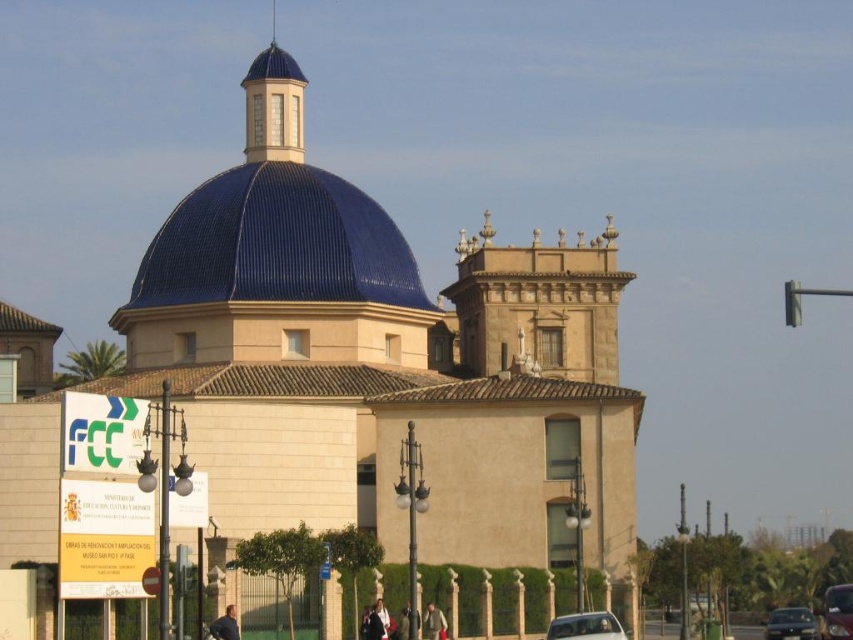
Question: Among these objects, which one is nearest to the camera?

Choices:
 (A) blue glass dome at upper center
 (B) metallic silver car at center
 (C) blue ceramic dome at center
 (D) white glossy car at lower center

Answer: (D)

Question: Can you confirm if blue ceramic dome at center is thinner than blue glass dome at upper center?

Choices:
 (A) no
 (B) yes

Answer: (A)

Question: Which object is the closest to the blue ceramic dome at center?

Choices:
 (A) metallic silver car at center
 (B) metallic silver car at lower right
 (C) white glossy car at lower center

Answer: (A)

Question: Does white glossy car at lower center appear on the right side of metallic silver car at center?

Choices:
 (A) yes
 (B) no

Answer: (B)

Question: Among these objects, which one is farthest from the camera?

Choices:
 (A) blue ceramic dome at center
 (B) metallic silver car at lower right
 (C) metallic silver car at center
 (D) white glossy car at lower center

Answer: (A)

Question: Where is blue glass dome at upper center located in relation to metallic silver car at center in the image?

Choices:
 (A) below
 (B) above

Answer: (B)